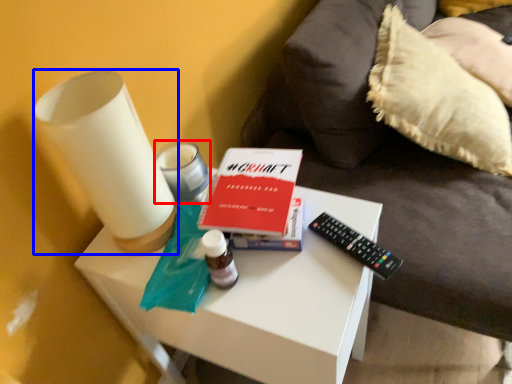
Question: Which of the following is the closest to the observer, candle holder (highlighted by a red box) or candle holder (highlighted by a blue box)?

Choices:
 (A) candle holder
 (B) candle holder

Answer: (B)